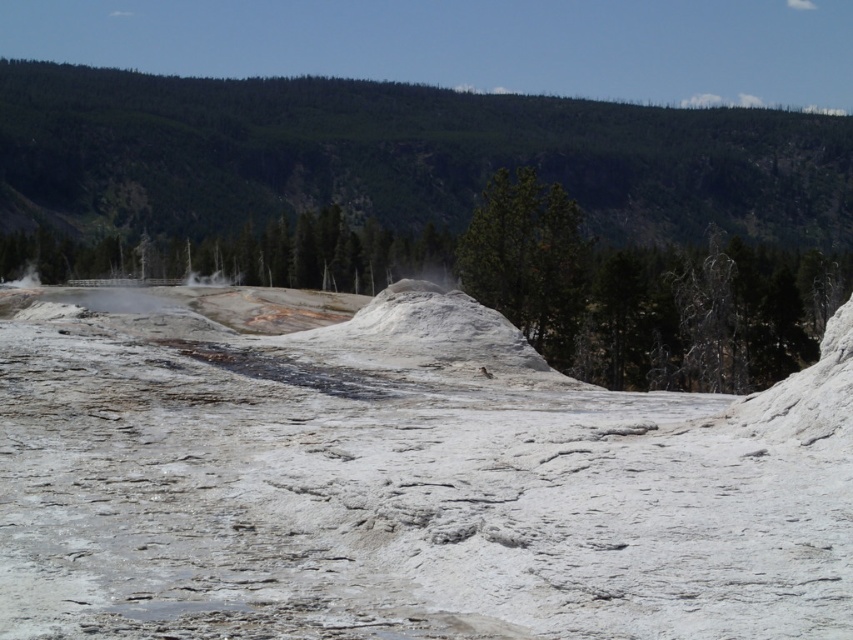
How far apart are white matte snow at center and green forested mountain at upper center?

The distance of white matte snow at center from green forested mountain at upper center is 221.69 meters.

Does white matte snow at center appear under green forested mountain at upper center?

Indeed, white matte snow at center is positioned under green forested mountain at upper center.

Does point (112, 326) lie behind point (84, 216)?

No.

Find the location of a particular element. white matte snow at center is located at coordinates (398, 477).